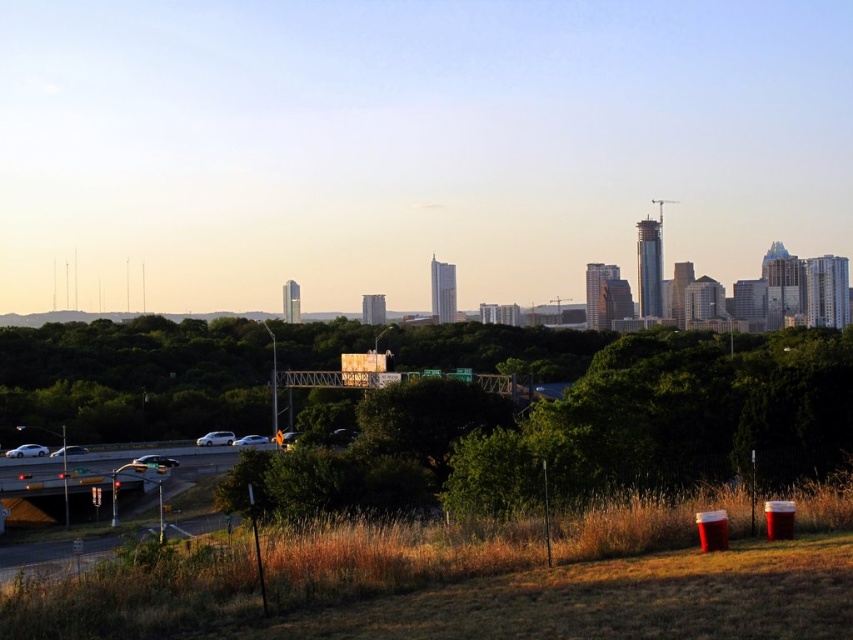
Question: Among these objects, which one is farthest from the camera?

Choices:
 (A) white matte car at lower left
 (B) satin black sedan at lower center
 (C) silver metallic sedan at lower left

Answer: (A)

Question: Does silver metallic sedan at lower left have a smaller size compared to satin silver sedan at lower left?

Choices:
 (A) yes
 (B) no

Answer: (B)

Question: Which point is closer to the camera taking this photo?

Choices:
 (A) (218, 444)
 (B) (79, 445)

Answer: (A)

Question: Considering the real-world distances, which object is farthest from the white matte car at lower left?

Choices:
 (A) silver metallic sedan at lower left
 (B) silver metallic car at lower left
 (C) satin black sedan at lower center
 (D) satin silver sedan at lower left

Answer: (C)

Question: Where is white matte car at lower left located in relation to silver metallic car at lower left in the image?

Choices:
 (A) above
 (B) below

Answer: (B)

Question: Can you confirm if white matte car at lower left is positioned below satin silver sedan at lower left?

Choices:
 (A) no
 (B) yes

Answer: (B)